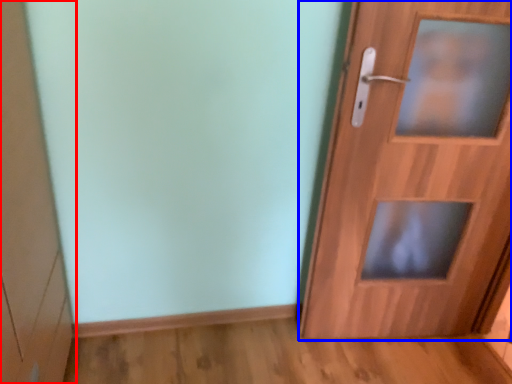
Question: Which point is closer to the camera, cabinetry (highlighted by a red box) or door (highlighted by a blue box)?

Choices:
 (A) cabinetry
 (B) door

Answer: (A)